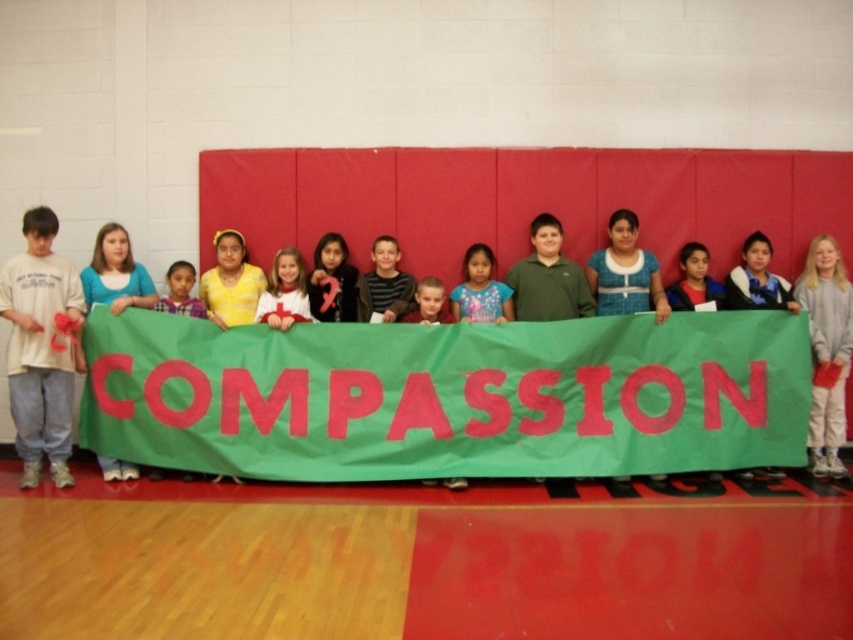
You are standing in the gymnasium and notice two points on the banner. Which point is closer to you, point (393, 241) or point (424, 291)?

Point (393, 241) is closer to you because it is further to the viewer than point (424, 291).

You are a photographer trying to capture a clear shot of both the yellow knit sweater at center and the matte yellow shirt at center. Since both are at the center, which one might be more visible in the photo due to its height?

The yellow knit sweater at center is taller than the matte yellow shirt at center, so it will be more visible in the photo.